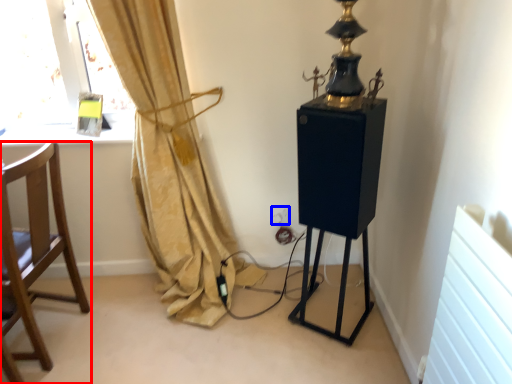
Question: Which point is closer to the camera, chair (highlighted by a red box) or electric outlet (highlighted by a blue box)?

Choices:
 (A) chair
 (B) electric outlet

Answer: (A)